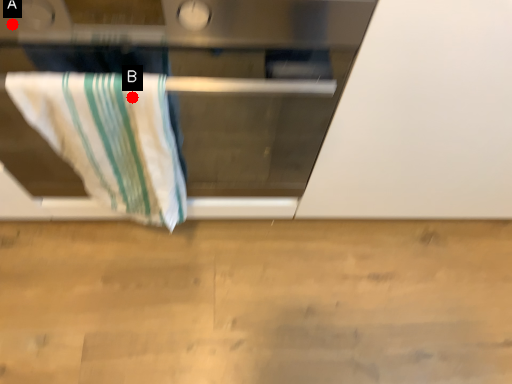
Question: Two points are circled on the image, labeled by A and B beside each circle. Which point is closer to the camera?

Choices:
 (A) A is closer
 (B) B is closer

Answer: (A)